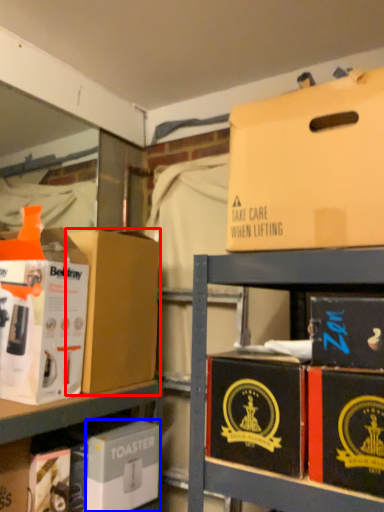
Question: Which object appears closest to the camera in this image, box (highlighted by a red box) or box (highlighted by a blue box)?

Choices:
 (A) box
 (B) box

Answer: (B)